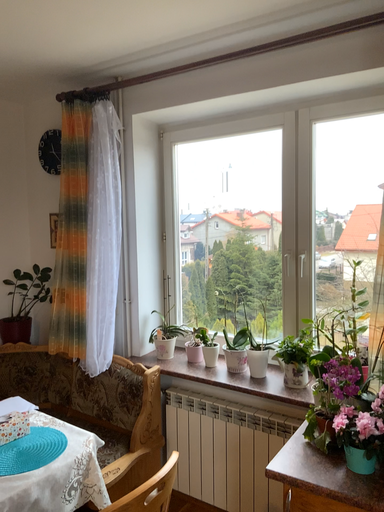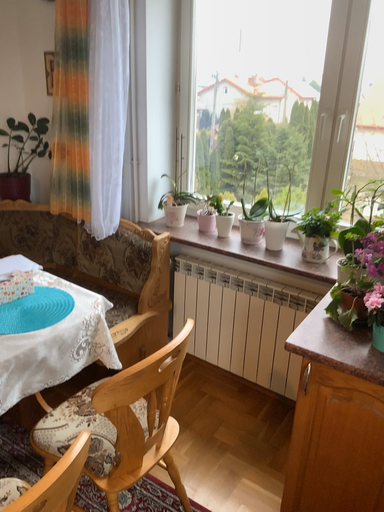
Question: Which way did the camera rotate in the video?

Choices:
 (A) rotated downward
 (B) rotated upward

Answer: (A)